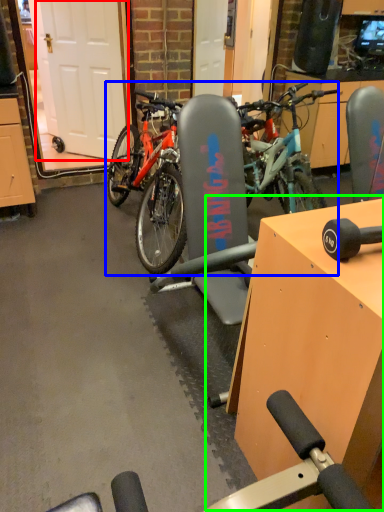
Question: Based on their relative distances, which object is farther from garage door (highlighted by a red box)? Choose from bicycle (highlighted by a blue box) and table (highlighted by a green box).

Choices:
 (A) bicycle
 (B) table

Answer: (B)